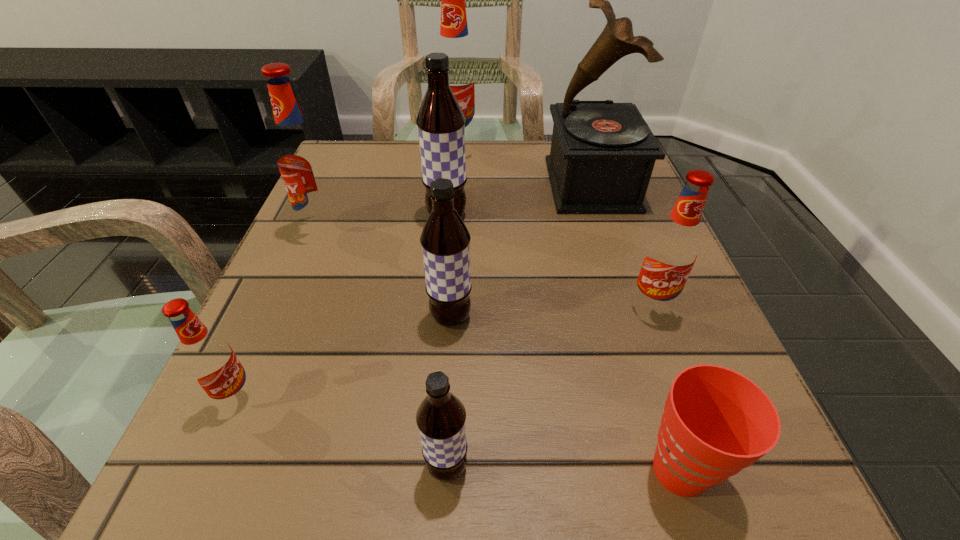
You are a GUI agent. You are given a task and a screenshot of the screen. Output one action in this format:
    pyautogui.click(x=<x>, y=<y>)
    Task: Click on the nearest brown root beer
    This screenshot has height=540, width=960.
    Given the screenshot: What is the action you would take?
    point(441,416)

Where is `the smallest brown root beer`? the smallest brown root beer is located at coordinates (441, 416).

The image size is (960, 540). I want to click on the shortest object, so click(x=716, y=422).

The height and width of the screenshot is (540, 960). In order to click on free space located on the front of the tallest root beer in this screenshot , I will do `click(451, 253)`.

You are a GUI agent. You are given a task and a screenshot of the screen. Output one action in this format:
    pyautogui.click(x=<x>, y=<y>)
    Task: Click on the free space located 0.130m at the horn opening of the phonograph_record
    The width and height of the screenshot is (960, 540).
    Given the screenshot: What is the action you would take?
    pyautogui.click(x=490, y=184)

The height and width of the screenshot is (540, 960). In order to click on vacant area situated 0.240m at the horn opening of the phonograph_record in this screenshot , I will do `click(439, 184)`.

In order to click on vacant space located at the horn opening of the phonograph_record in this screenshot , I will do `click(467, 184)`.

You are a GUI agent. You are given a task and a screenshot of the screen. Output one action in this format:
    pyautogui.click(x=<x>, y=<y>)
    Task: Click on the vacant space located on the right of the second biggest red root beer
    
    Given the screenshot: What is the action you would take?
    pyautogui.click(x=527, y=228)

This screenshot has width=960, height=540. Identify the location of vacant area located 0.340m on the right of the farthest brown root beer. (639, 215).

Where is `free region located 0.100m on the back of the rightmost red root beer`? This screenshot has height=540, width=960. free region located 0.100m on the back of the rightmost red root beer is located at coordinates (631, 252).